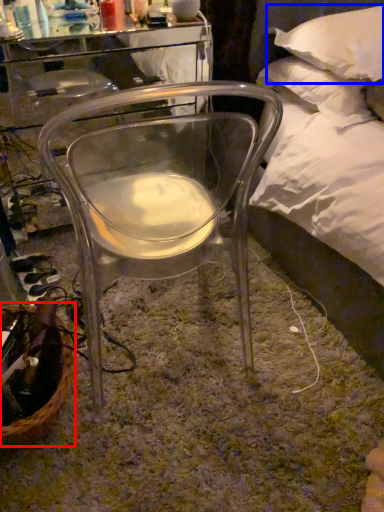
Question: Among these objects, which one is nearest to the camera, basket (highlighted by a red box) or pillow (highlighted by a blue box)?

Choices:
 (A) basket
 (B) pillow

Answer: (A)